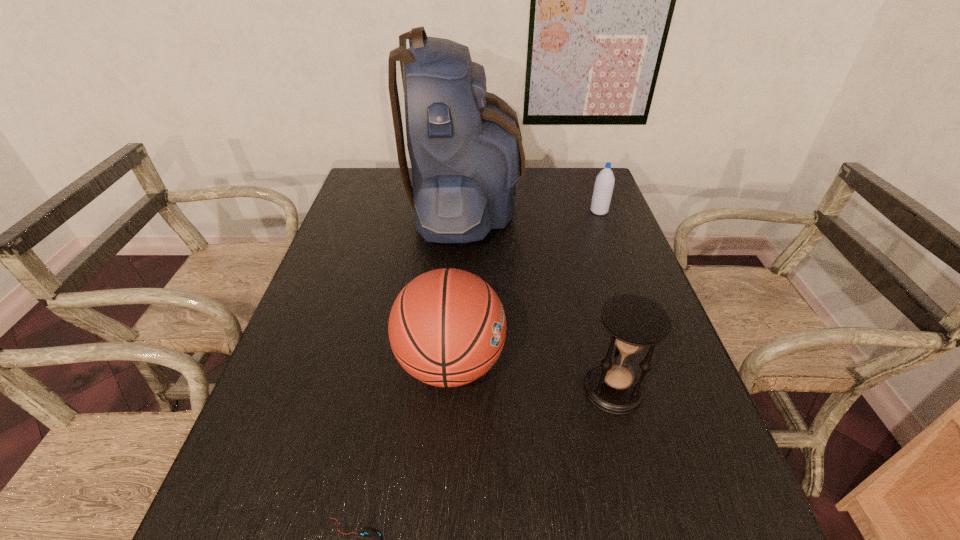
The image size is (960, 540). I want to click on backpack, so click(465, 146).

Identify the location of basketball. (447, 327).

Locate an element on the screen. The width and height of the screenshot is (960, 540). the fourth object from left to right is located at coordinates (635, 322).

At what (x,y) coordinates should I click in order to perform the action: click on the rightmost object. Please return your answer as a coordinate pair (x, y). This screenshot has height=540, width=960. Looking at the image, I should click on (604, 183).

You are a GUI agent. You are given a task and a screenshot of the screen. Output one action in this format:
    pyautogui.click(x=<x>, y=<y>)
    Task: Click on the fourth tallest object
    The height and width of the screenshot is (540, 960).
    Given the screenshot: What is the action you would take?
    pyautogui.click(x=604, y=183)

You are a GUI agent. You are given a task and a screenshot of the screen. Output one action in this format:
    pyautogui.click(x=<x>, y=<y>)
    Task: Click on the vacant area situated at the front pocket of the tallest object
    
    Given the screenshot: What is the action you would take?
    pyautogui.click(x=598, y=207)

Identify the location of vacant space located 0.270m on the logo side of the basketball. Image resolution: width=960 pixels, height=540 pixels. (626, 363).

Locate an element on the screen. free space located 0.110m on the right of the second object from right to left is located at coordinates (694, 388).

Image resolution: width=960 pixels, height=540 pixels. What are the coordinates of `blank area located on the back of the water bottle` in the screenshot? It's located at [x=592, y=193].

You are a GUI agent. You are given a task and a screenshot of the screen. Output one action in this format:
    pyautogui.click(x=<x>, y=<y>)
    Task: Click on the object that is at the far edge
    The image size is (960, 540).
    Given the screenshot: What is the action you would take?
    pyautogui.click(x=465, y=146)